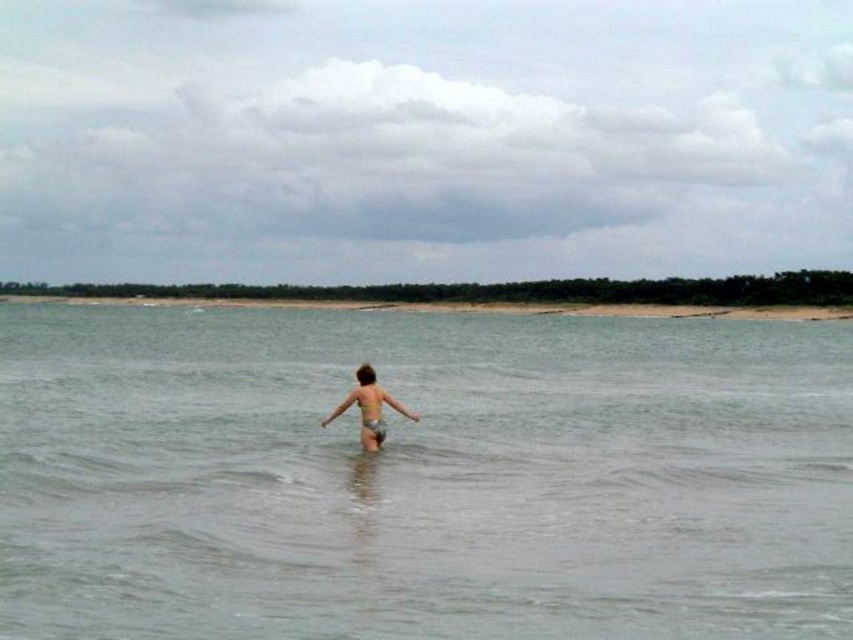
Question: Does clear water at center have a larger size compared to light brown skin at center?

Choices:
 (A) no
 (B) yes

Answer: (B)

Question: Which point appears closest to the camera in this image?

Choices:
 (A) (381, 440)
 (B) (502, 323)

Answer: (A)

Question: Which point is closer to the camera?

Choices:
 (A) (360, 385)
 (B) (444, 595)

Answer: (B)

Question: Can you confirm if clear water at center is positioned to the right of light brown skin at center?

Choices:
 (A) no
 (B) yes

Answer: (A)

Question: Is clear water at center above light brown skin at center?

Choices:
 (A) yes
 (B) no

Answer: (A)